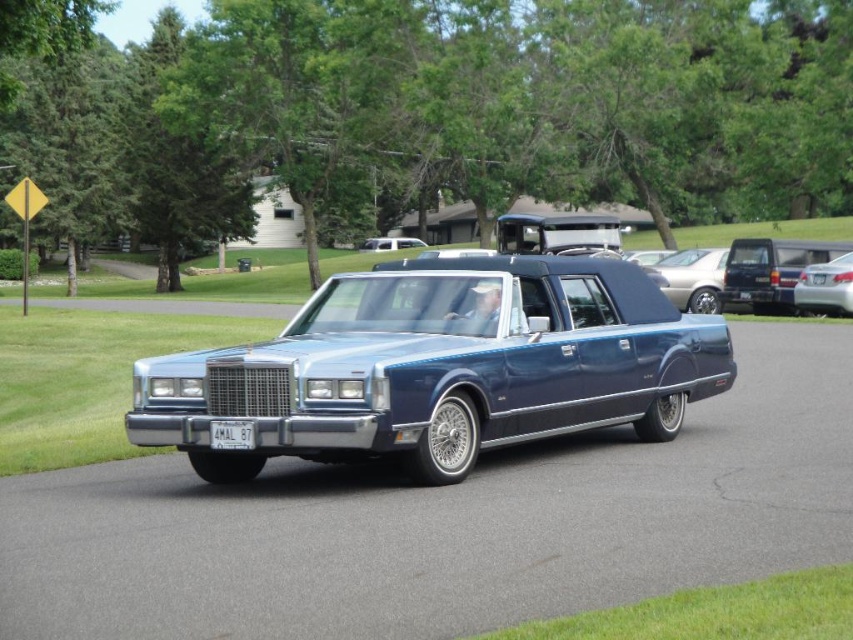
Does point (840, 253) come farther from viewer compared to point (393, 248)?

No, it is not.

Is silver metallic sedan at center-right taller than matte black limousine at center?

No.

Who is more distant from viewer, (810, 268) or (378, 241)?

Point (378, 241)

Find the location of `silver metallic sedan at center-right`. silver metallic sedan at center-right is located at coordinates (825, 288).

Between metallic blue car at center and silver metallic sedan at center-right, which one has less height?

Standing shorter between the two is silver metallic sedan at center-right.

Does metallic blue car at center have a lesser height compared to silver metallic sedan at center-right?

In fact, metallic blue car at center may be taller than silver metallic sedan at center-right.

The width and height of the screenshot is (853, 640). I want to click on metallic blue car at center, so click(x=447, y=524).

The width and height of the screenshot is (853, 640). Find the location of `metallic blue car at center`. metallic blue car at center is located at coordinates (447, 524).

Based on the photo, which is above, metallic blue sedan at center or white plastic license plate at center?

white plastic license plate at center

Which is behind, point (432, 397) or point (213, 445)?

The point (432, 397) is more distant.

At what (x,y) coordinates should I click in order to perform the action: click on metallic blue sedan at center. Please return your answer as a coordinate pair (x, y). This screenshot has width=853, height=640. Looking at the image, I should click on (440, 365).